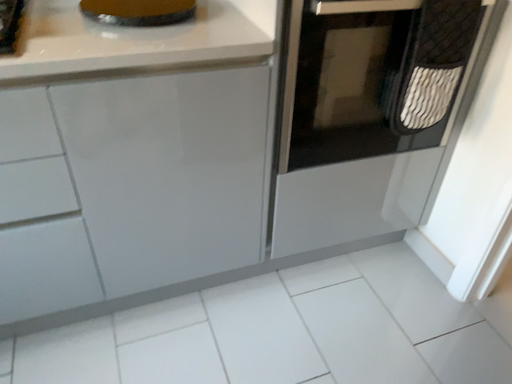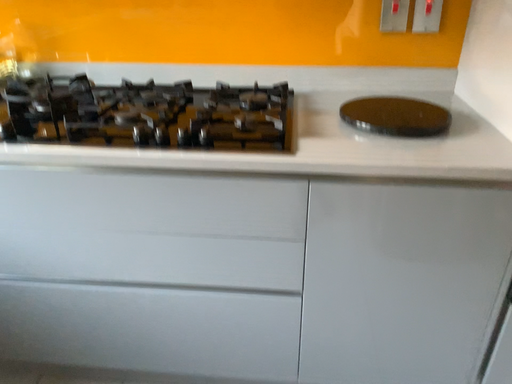
Question: Which way did the camera rotate in the video?

Choices:
 (A) rotated downward
 (B) rotated upward

Answer: (B)